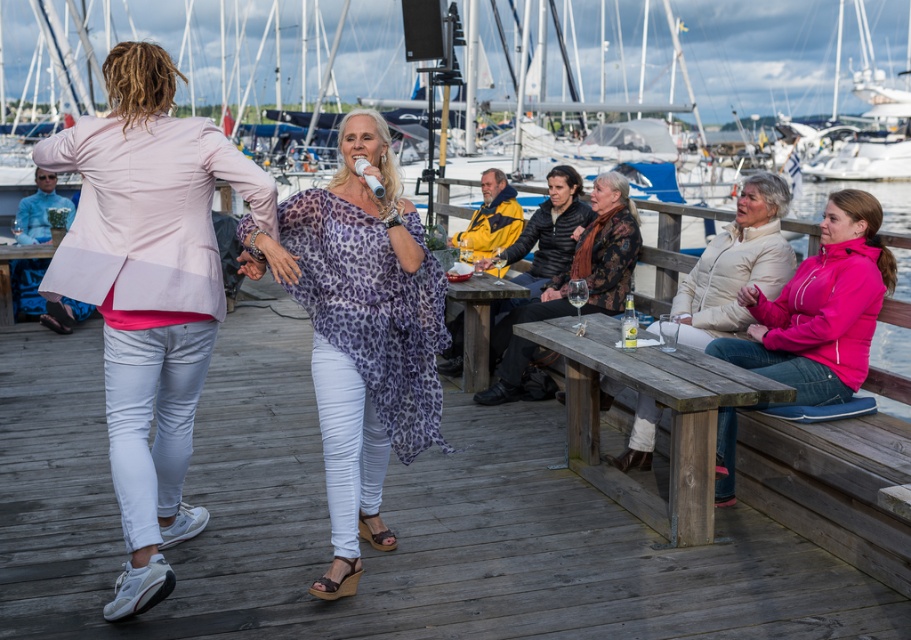
You are a photographer trying to capture a photo of the wooden picnic table at center without the pink fabric jacket at left overlapping it. Given their sizes, is this possible?

The pink fabric jacket at left is larger in size than wooden picnic table at center, so it might block the view of the wooden picnic table at center. Adjust your angle to avoid overlap.

Based on the photo, you are standing at the edge of the marina and want to locate the wooden deck at center. According to the coordinates provided, where should you look?

The wooden deck at center is located at coordinates point [381,515].

Based on the photo, you are a photographer standing at the edge of the marina. You want to take a photo that includes both the leopard print fabric at center and the wooden picnic table at lower right. Is there enough space between them to fit both in the frame without overlapping?

The leopard print fabric at center and wooden picnic table at lower right are 1.44 meters apart. Since the distance between them is sufficient, the photographer can capture both in the frame without overlapping.